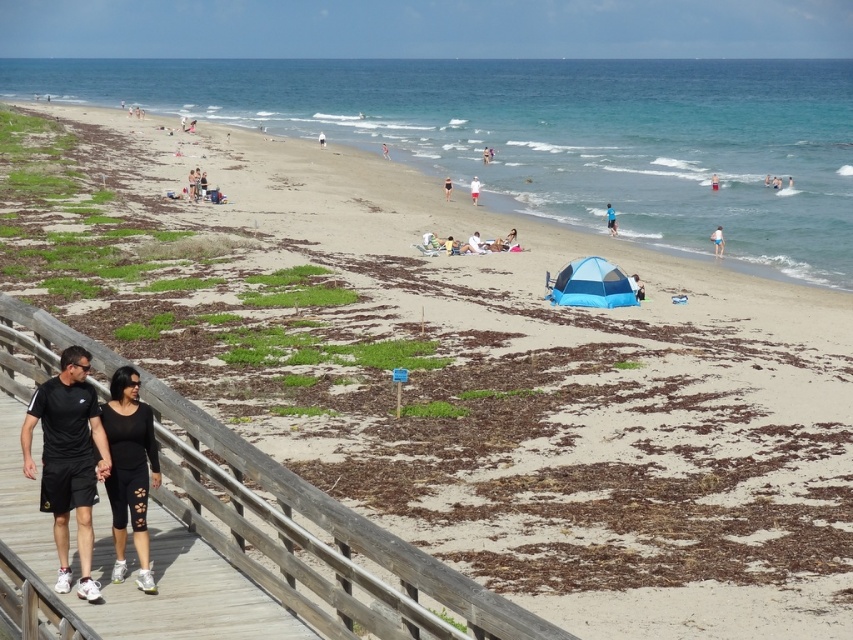
Question: Does black athletic wear at lower left appear on the right side of black swimsuit at center?

Choices:
 (A) yes
 (B) no

Answer: (B)

Question: Is wooden at lower left to the right of black swimsuit at center from the viewer's perspective?

Choices:
 (A) yes
 (B) no

Answer: (B)

Question: Which is farther from the black matte leggings at lower left?

Choices:
 (A) black swimsuit at center
 (B) black athletic wear at lower left
 (C) wooden at lower left

Answer: (A)

Question: Among these objects, which one is nearest to the camera?

Choices:
 (A) white fabric umbrella at center
 (B) black athletic wear at lower left
 (C) black swimsuit at center
 (D) black matte leggings at lower left

Answer: (B)

Question: Where is black athletic wear at lower left located in relation to white fabric umbrella at center in the image?

Choices:
 (A) below
 (B) above

Answer: (A)

Question: Which point is closer to the camera taking this photo?

Choices:
 (A) (445, 186)
 (B) (479, 189)

Answer: (B)